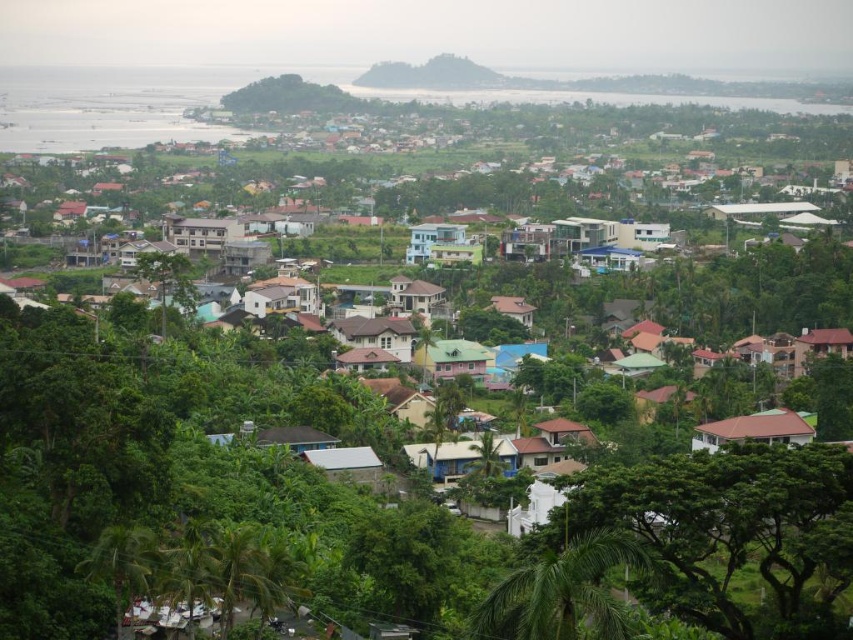
Question: Which object appears farthest from the camera in this image?

Choices:
 (A) green leafy tree at lower right
 (B) green leafy palm at center

Answer: (B)

Question: Can you confirm if green leafy tree at lower right is positioned above green leafy palm at center?

Choices:
 (A) no
 (B) yes

Answer: (A)

Question: Which point appears closest to the camera in this image?

Choices:
 (A) (552, 573)
 (B) (682, 509)

Answer: (A)

Question: Does green leafy tree at lower right appear on the left side of green leafy palm at center?

Choices:
 (A) yes
 (B) no

Answer: (B)

Question: Is green leafy tree at lower right below green leafy palm at center?

Choices:
 (A) yes
 (B) no

Answer: (A)